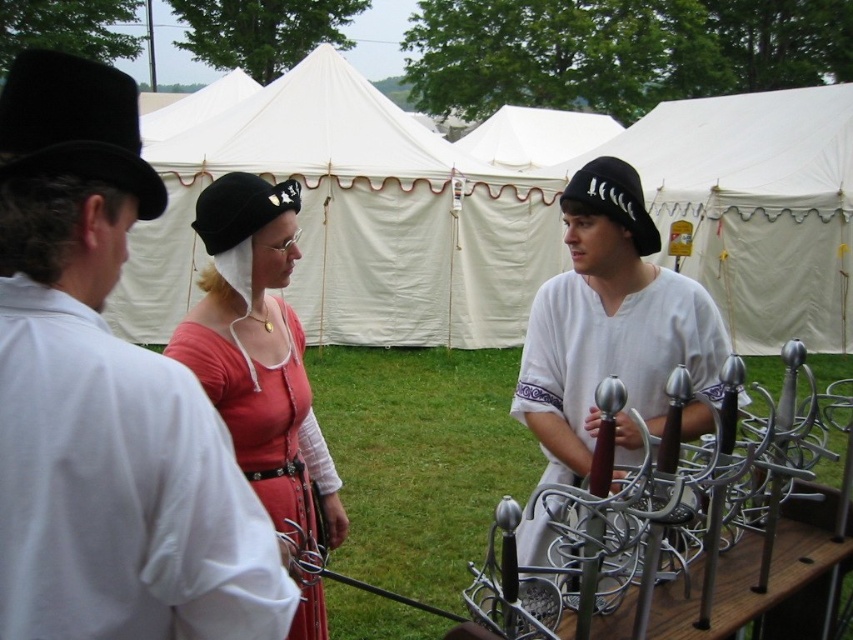
Question: Which object appears closest to the camera in this image?

Choices:
 (A) matte red dress at center
 (B) white canvas tent at center
 (C) white matte shirt at left
 (D) white matte shirt at center

Answer: (C)

Question: Among these points, which one is nearest to the camera?

Choices:
 (A) (389, 220)
 (B) (62, 77)
 (C) (653, 388)
 (D) (273, 502)

Answer: (B)

Question: Does white canvas tent at center appear under white matte shirt at left?

Choices:
 (A) no
 (B) yes

Answer: (A)

Question: Is white canvas tent at center bigger than white matte shirt at left?

Choices:
 (A) yes
 (B) no

Answer: (A)

Question: Is white matte shirt at center further to camera compared to matte red dress at center?

Choices:
 (A) no
 (B) yes

Answer: (B)

Question: Which point is farther from the camera taking this photo?

Choices:
 (A) (73, 196)
 (B) (292, 333)

Answer: (B)